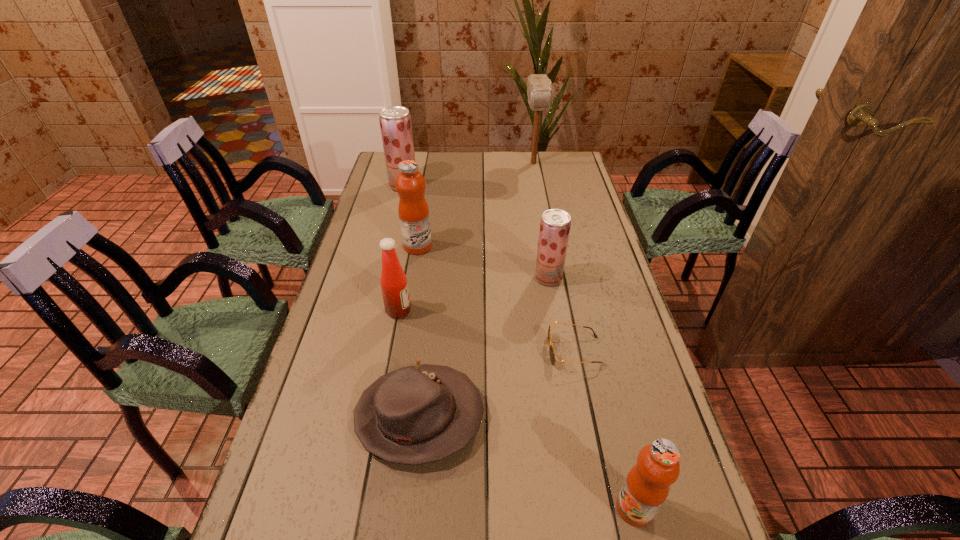
Where is `empty space between the nearer strawberry fruit juice and the second shortest object`? The height and width of the screenshot is (540, 960). empty space between the nearer strawberry fruit juice and the second shortest object is located at coordinates (484, 347).

This screenshot has height=540, width=960. In order to click on unoccupied position between the second fruit juice from right to left and the bigger strawberry fruit juice in this screenshot , I will do `click(476, 232)`.

The height and width of the screenshot is (540, 960). Find the location of `empty space that is in between the nearest object and the second shortest object`. empty space that is in between the nearest object and the second shortest object is located at coordinates (527, 462).

Find the location of a particular element. This screenshot has width=960, height=540. vacant space that's between the second shortest object and the shortest object is located at coordinates (497, 384).

Where is `vacant space in between the fourth nearest object and the farther strawberry fruit juice`? vacant space in between the fourth nearest object and the farther strawberry fruit juice is located at coordinates (401, 248).

Select which object is the closest to the farther strawberry fruit juice. Please provide its 2D coordinates. Your answer should be formatted as a tuple, i.e. [(x, y)], where the tuple contains the x and y coordinates of a point satisfying the conditions above.

[(413, 210)]

Where is `object that is the third closest to the shortest object`? object that is the third closest to the shortest object is located at coordinates (646, 487).

This screenshot has height=540, width=960. I want to click on fruit juice object that ranks as the closest to the farthest object, so click(x=395, y=121).

Identify which fruit juice is located as the nearest to the nearer strawberry fruit juice. Please provide its 2D coordinates. Your answer should be formatted as a tuple, i.e. [(x, y)], where the tuple contains the x and y coordinates of a point satisfying the conditions above.

[(413, 210)]

The image size is (960, 540). I want to click on free space that satisfies the following two spatial constraints: 1. on the striking face of the mallet; 2. on the front label of the bigger orange fruit juice, so click(549, 246).